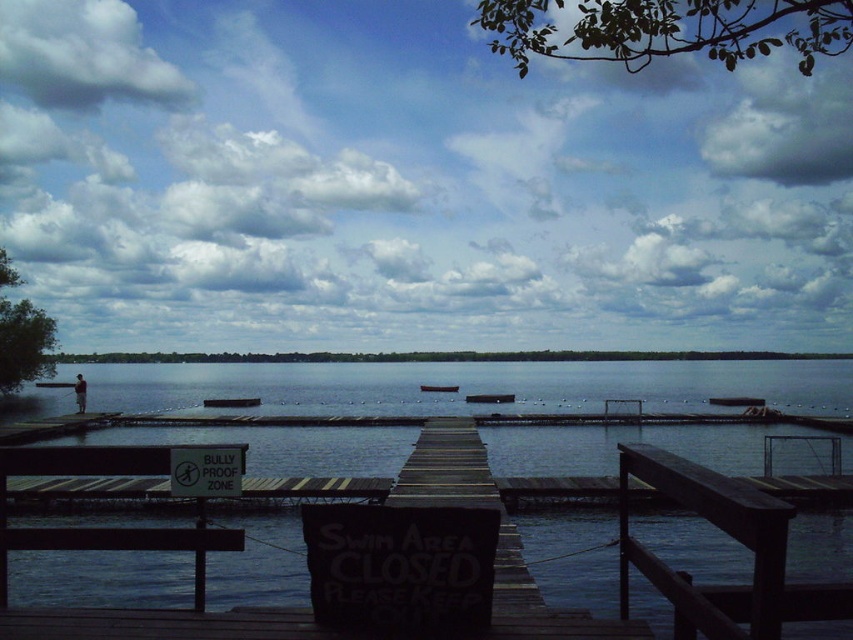
Does wooden dock at center lie behind dark gray plastic boat at center?

That is False.

Can you confirm if wooden dock at center is shorter than dark gray plastic boat at center?

Indeed, wooden dock at center has a lesser height compared to dark gray plastic boat at center.

The image size is (853, 640). Describe the element at coordinates (231, 403) in the screenshot. I see `wooden dock at center` at that location.

The height and width of the screenshot is (640, 853). I want to click on wooden dock at center, so click(231, 403).

Does dark wood dock at center come in front of white plastic sign at center?

Yes, dark wood dock at center is in front of white plastic sign at center.

Between dark wood dock at center and white plastic sign at center, which one appears on the left side from the viewer's perspective?

From the viewer's perspective, white plastic sign at center appears more on the left side.

Is point (419, 486) behind point (196, 451)?

Yes, it is behind point (196, 451).

You are a GUI agent. You are given a task and a screenshot of the screen. Output one action in this format:
    pyautogui.click(x=<x>, y=<y>)
    Task: Click on the dark wood dock at center
    Image resolution: width=853 pixels, height=640 pixels.
    Given the screenshot: What is the action you would take?
    pyautogui.click(x=161, y=625)

Who is taller, wooden dock at center or dark gray wooden dock at center?

With more height is dark gray wooden dock at center.

Is wooden dock at center further to camera compared to dark gray wooden dock at center?

Yes, wooden dock at center is behind dark gray wooden dock at center.

Is point (236, 404) positioned after point (721, 403)?

No, (236, 404) is closer to viewer.

The image size is (853, 640). Identify the location of wooden dock at center. (231, 403).